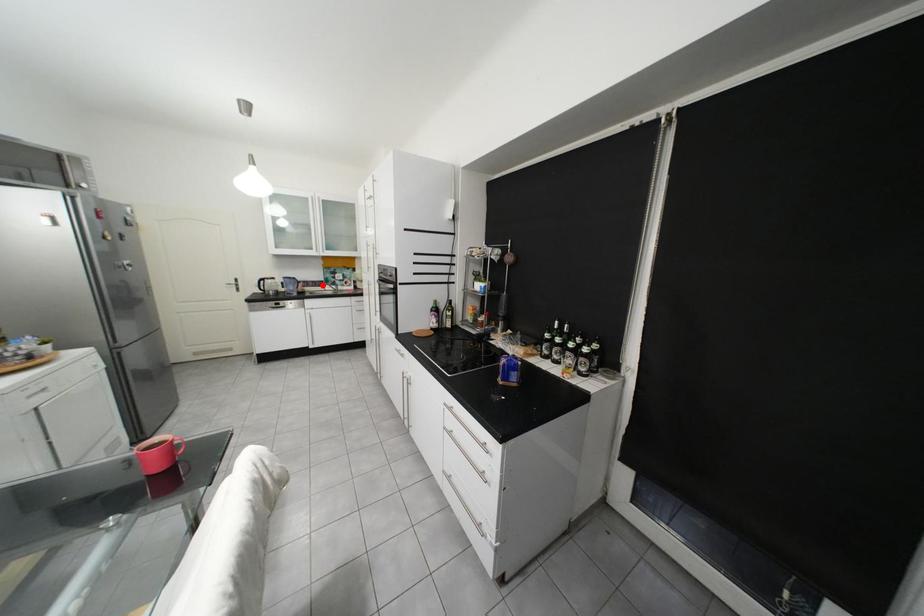
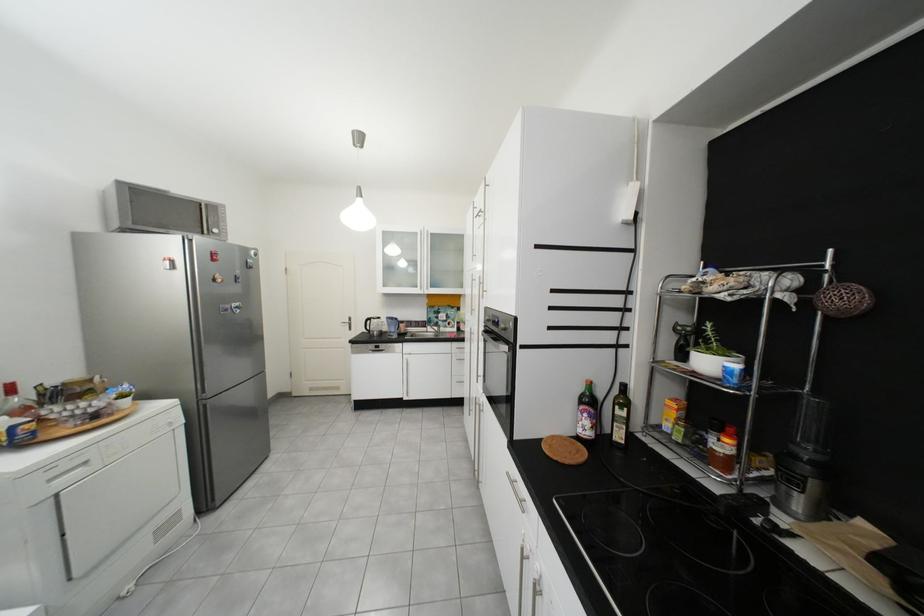
Find the pixel in the second image that matches the highlighted location in the first image.

(426, 325)